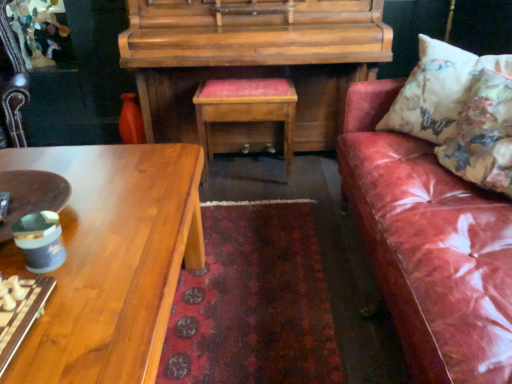
Image resolution: width=512 pixels, height=384 pixels. What are the coordinates of `woodenwoodentable at center` in the screenshot? It's located at (245, 109).

How much space does floral fabric cushion at right, which ranks as the 1th pillow in front-to-back order, occupy horizontally?

The width of floral fabric cushion at right, which ranks as the 1th pillow in front-to-back order, is 13.66 inches.

The width and height of the screenshot is (512, 384). Describe the element at coordinates (31, 195) in the screenshot. I see `matte brown bowl at left` at that location.

Where is `shiny wood coffee table at lower left`? The image size is (512, 384). shiny wood coffee table at lower left is located at coordinates (113, 260).

Who is taller, leather couch at right or shiny wood coffee table at lower left?

With more height is leather couch at right.

Is leather couch at right in front of or behind shiny wood coffee table at lower left in the image?

Clearly, leather couch at right is in front of shiny wood coffee table at lower left.

Which is closer, (433, 206) or (9, 260)?

Clearly, point (433, 206) is more distant from the camera than point (9, 260).

From the image's perspective, which is above, leather couch at right or shiny wood coffee table at lower left?

leather couch at right.

From the image's perspective, is matte brown bowl at left located above or below woodenwoodentable at center?

Based on their image positions, matte brown bowl at left is located beneath woodenwoodentable at center.

Is matte brown bowl at left shorter than woodenwoodentable at center?

Indeed, matte brown bowl at left has a lesser height compared to woodenwoodentable at center.

Consider the image. From a real-world perspective, is matte brown bowl at left below woodenwoodentable at center?

No, from a real-world perspective, matte brown bowl at left is not beneath woodenwoodentable at center.

Is matte brown bowl at left next to woodenwoodentable at center and touching it?

matte brown bowl at left is not next to woodenwoodentable at center, and they're not touching.

Considering the relative positions of floral fabric cushion at right, marked as the 2th pillow in a front-to-back arrangement, and shiny wood coffee table at lower left in the image provided, is floral fabric cushion at right, marked as the 2th pillow in a front-to-back arrangement, in front of shiny wood coffee table at lower left?

No, floral fabric cushion at right, marked as the 2th pillow in a front-to-back arrangement, is further to the viewer.

Is floral fabric cushion at right, marked as the 2th pillow in a front-to-back arrangement, aimed at shiny wood coffee table at lower left?

Yes, floral fabric cushion at right, marked as the 2th pillow in a front-to-back arrangement, is aimed at shiny wood coffee table at lower left.

From a real-world perspective, is floral fabric cushion at right, marked as the 2th pillow in a front-to-back arrangement, over shiny wood coffee table at lower left?

Correct, in the physical world, floral fabric cushion at right, marked as the 2th pillow in a front-to-back arrangement, is higher than shiny wood coffee table at lower left.

Between wooden piano at center and leather couch at right, which one has less height?

leather couch at right.

Looking at this image, which object is closer to the camera taking this photo, wooden piano at center or leather couch at right?

leather couch at right.

From the picture: Is wooden piano at center facing towards leather couch at right?

Yes, wooden piano at center is oriented towards leather couch at right.

Which object is wider, leather couch at right or floral fabric cushion at right, which is the first pillow in back-to-front order?

With larger width is leather couch at right.

From the picture: Could floral fabric cushion at right, marked as the 2th pillow in a front-to-back arrangement, be considered to be inside leather couch at right?

That's correct, floral fabric cushion at right, marked as the 2th pillow in a front-to-back arrangement, is inside leather couch at right.

Is leather couch at right facing away from floral fabric cushion at right, marked as the 2th pillow in a front-to-back arrangement?

Absolutely, leather couch at right is directed away from floral fabric cushion at right, marked as the 2th pillow in a front-to-back arrangement.

From a real-world perspective, is matte brown bowl at left above or below leather couch at right?

matte brown bowl at left is above leather couch at right.

Is matte brown bowl at left bigger than leather couch at right?

Incorrect, matte brown bowl at left is not larger than leather couch at right.

Between matte brown bowl at left and leather couch at right, which one has less height?

matte brown bowl at left.

How far apart are matte brown bowl at left and leather couch at right?

matte brown bowl at left and leather couch at right are 1.09 meters apart.

Is woodenwoodentable at center at the right side of matte brown bowl at left?

Indeed, woodenwoodentable at center is positioned on the right side of matte brown bowl at left.

Image resolution: width=512 pixels, height=384 pixels. Find the location of `round table that is below the woodenwoodentable at center (from the image's perspective)`. round table that is below the woodenwoodentable at center (from the image's perspective) is located at coordinates (31, 195).

How far apart are woodenwoodentable at center and matte brown bowl at left?

woodenwoodentable at center and matte brown bowl at left are 1.12 meters apart.

From the image's perspective, is woodenwoodentable at center located beneath matte brown bowl at left?

No, from the image's perspective, woodenwoodentable at center is not beneath matte brown bowl at left.

The image size is (512, 384). I want to click on coffee table that is on the left side of leather couch at right, so click(x=113, y=260).

Where is `round table in front of the woodenwoodentable at center`? This screenshot has width=512, height=384. round table in front of the woodenwoodentable at center is located at coordinates (31, 195).

When comparing their distances from leather couch at right, does floral fabric cushion at right, which is the first pillow in back-to-front order, or shiny wood coffee table at lower left seem closer?

floral fabric cushion at right, which is the first pillow in back-to-front order, is closer to leather couch at right.

Based on their spatial positions, is floral fabric cushion at right, which is the first pillow in back-to-front order, or matte brown bowl at left closer to wooden piano at center?

floral fabric cushion at right, which is the first pillow in back-to-front order, lies closer to wooden piano at center than the other object.

From the image, which object appears to be farther from woodenwoodentable at center, floral fabric cushion at right, which is the first pillow in back-to-front order, or shiny wood coffee table at lower left?

shiny wood coffee table at lower left is further to woodenwoodentable at center.

When comparing their distances from shiny wood coffee table at lower left, does leather couch at right or woodenwoodentable at center seem closer?

Based on the image, leather couch at right appears to be nearer to shiny wood coffee table at lower left.

In the scene shown: Estimate the real-world distances between objects in this image. Which object is closer to floral fabric cushion at right, which ranks as the 1th pillow in front-to-back order, wooden piano at center or floral fabric cushion at right, which is the first pillow in back-to-front order?

Based on the image, floral fabric cushion at right, which is the first pillow in back-to-front order, appears to be nearer to floral fabric cushion at right, which ranks as the 1th pillow in front-to-back order.

Looking at this image, estimate the real-world distances between objects in this image. Which object is further from floral fabric cushion at right, placed as the second pillow when sorted from back to front, matte brown bowl at left or floral fabric cushion at right, marked as the 2th pillow in a front-to-back arrangement?

matte brown bowl at left lies further to floral fabric cushion at right, placed as the second pillow when sorted from back to front, than the other object.

Estimate the real-world distances between objects in this image. Which object is further from leather couch at right, wooden piano at center or shiny wood coffee table at lower left?

wooden piano at center is further to leather couch at right.

Based on their spatial positions, is woodenwoodentable at center or leather couch at right closer to shiny wood coffee table at lower left?

leather couch at right.

Where is `coffee table between leather couch at right and wooden piano at center along the z-axis`? coffee table between leather couch at right and wooden piano at center along the z-axis is located at coordinates (113, 260).

I want to click on piano between matte brown bowl at left and floral fabric cushion at right, which is the first pillow in back-to-front order, in the horizontal direction, so click(252, 57).

Locate an element on the screen. This screenshot has width=512, height=384. coffee table situated between matte brown bowl at left and floral fabric cushion at right, which is the first pillow in back-to-front order, from left to right is located at coordinates (113, 260).

This screenshot has height=384, width=512. I want to click on piano between matte brown bowl at left and floral fabric cushion at right, which ranks as the 1th pillow in front-to-back order, in the horizontal direction, so click(x=252, y=57).